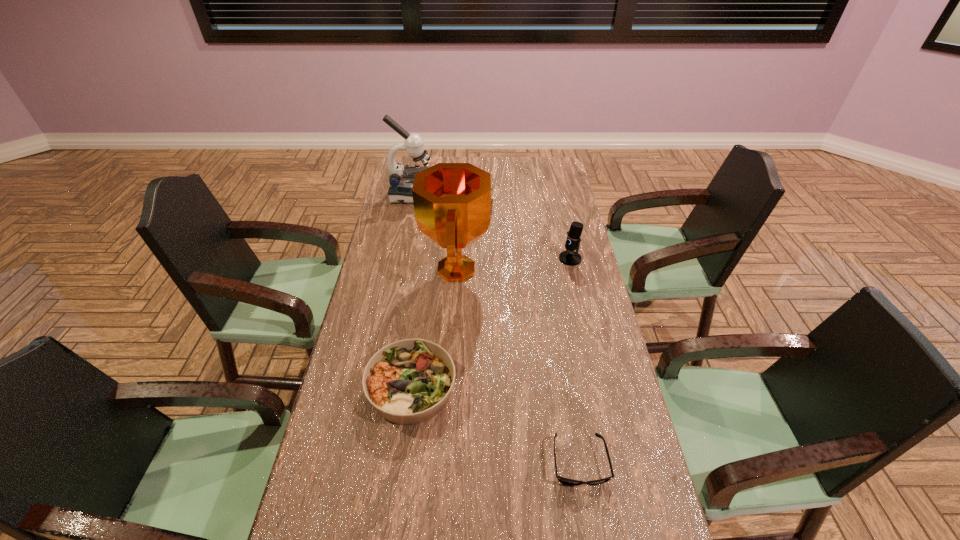
In order to click on free point at the far right corner in this screenshot , I will do `click(532, 163)`.

At what (x,y) coordinates should I click in order to perform the action: click on vacant area that lies between the nearest object and the fourth tallest object. Please return your answer as a coordinate pair (x, y). The width and height of the screenshot is (960, 540). Looking at the image, I should click on (495, 426).

Where is `empty location between the third tallest object and the salad plate`? empty location between the third tallest object and the salad plate is located at coordinates (491, 323).

Where is `vacant area that lies between the award and the sunglasses`? This screenshot has height=540, width=960. vacant area that lies between the award and the sunglasses is located at coordinates (518, 366).

What are the coordinates of `free space between the microscope and the shortest object` in the screenshot? It's located at (495, 329).

Identify the location of free spot between the microphone and the award. (514, 264).

The image size is (960, 540). In order to click on empty space that is in between the microphone and the nearest object in this screenshot , I will do `click(575, 360)`.

The width and height of the screenshot is (960, 540). Identify the location of vacant region between the nearest object and the second shortest object. (495, 426).

Locate an element on the screen. the second closest object to the shortest object is located at coordinates (453, 208).

Identify the location of the closest object to the award. (409, 381).